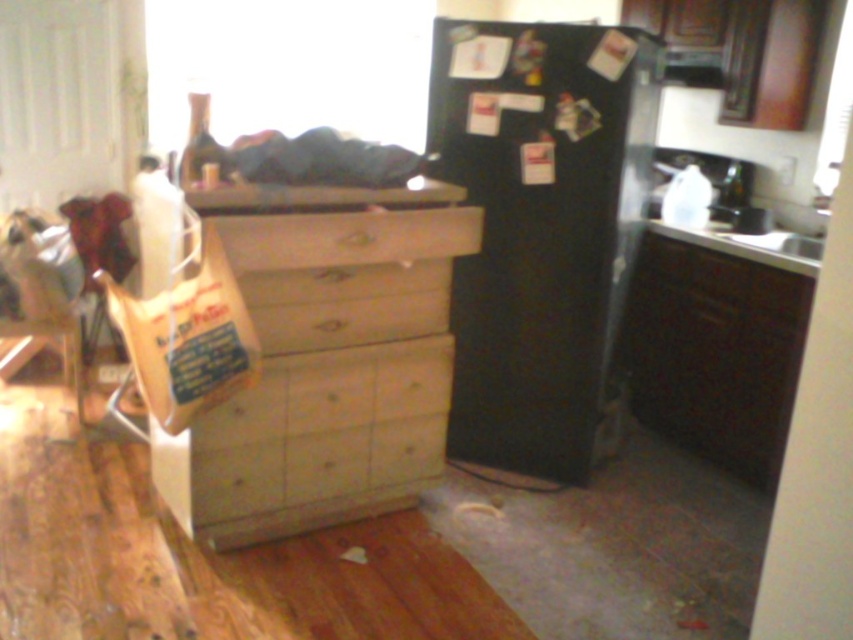
You are trying to decide where to place a tall plant that needs to fit under a low ceiling shelf. Which object between the matte wood dresser at lower right and the wooden drawer at center would be better suited for placing the plant to ensure it doesn

The wooden drawer at center has a smaller height compared to the matte wood dresser at lower right, so placing the tall plant on the wooden drawer at center would be better to ensure it fits under the low ceiling shelf.

You are standing in the kitchen and see two points marked on the floor. The first point is at coordinates point [660,273] and the second is at point [310,232]. If you were to walk from the refrigerator towards the dresser, which point would you step on first?

Point [310,232] would be stepped on first because it is in front of point [660,273], which is behind it.

You are standing in the kitchen and need to place a new appliance. Where exactly is the black matte refrigerator at center located in terms of coordinates?

The black matte refrigerator at center is located at coordinates point [540,227].